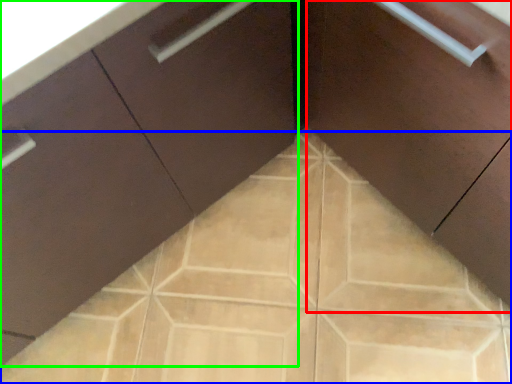
Question: Which object is positioned farthest from cabinetry (highlighted by a red box)? Select from ceramic tile (highlighted by a blue box) and cabinetry (highlighted by a green box).

Choices:
 (A) ceramic tile
 (B) cabinetry

Answer: (A)